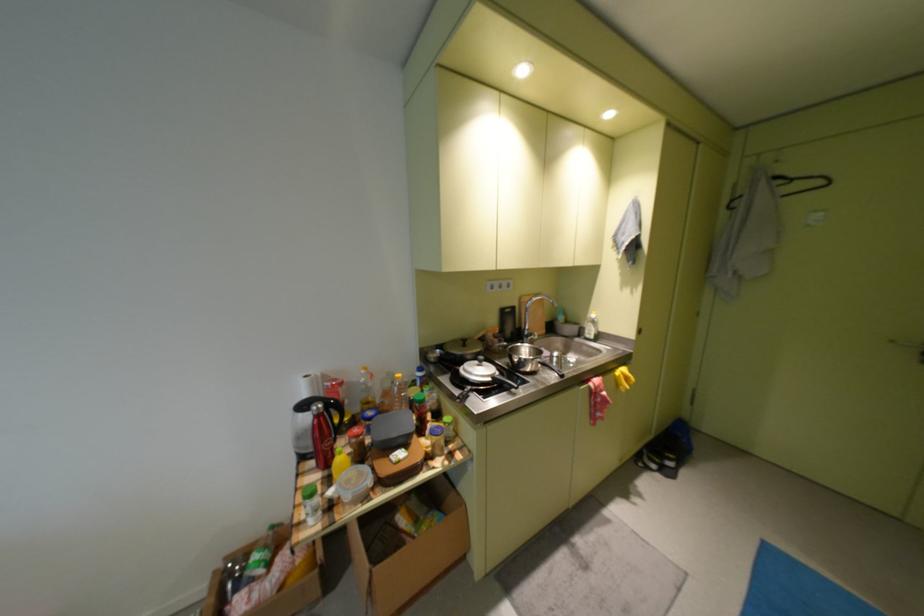
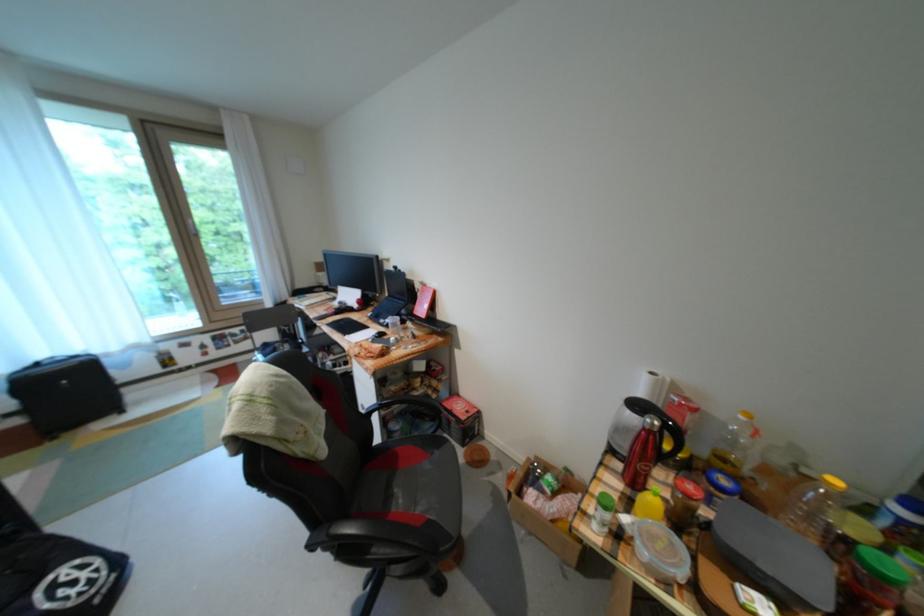
In the second image, find the point that corresponds to the point at 371,382 in the first image.

(742, 429)